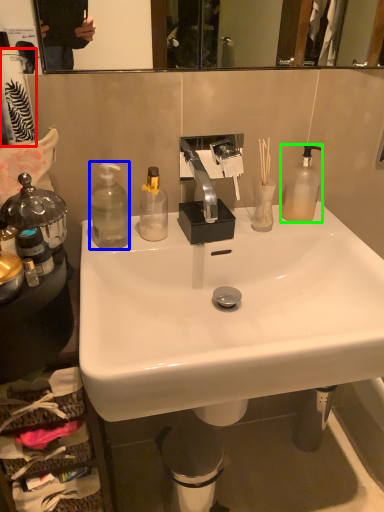
Question: Estimate the real-world distances between objects in this image. Which object is closer to toilet paper (highlighted by a red box), bottle (highlighted by a blue box) or bottle (highlighted by a green box)?

Choices:
 (A) bottle
 (B) bottle

Answer: (A)